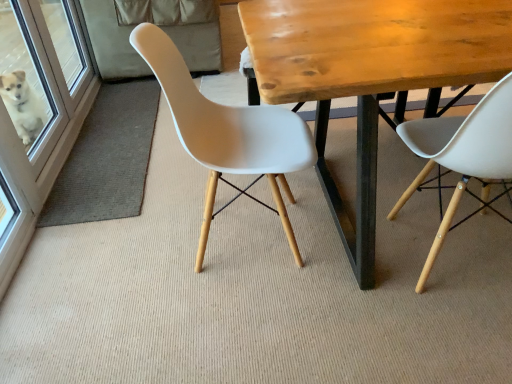
This screenshot has height=384, width=512. What do you see at coordinates (370, 74) in the screenshot?
I see `wooden table at center` at bounding box center [370, 74].

Describe the element at coordinates (227, 133) in the screenshot. The image size is (512, 384). I see `white plastic chair at center, the 1th chair positioned from the left` at that location.

Where is `white glossy screen door at left`? white glossy screen door at left is located at coordinates (40, 109).

Find the location of a particular element. This screenshot has height=384, width=512. wooden table at center is located at coordinates (370, 74).

Is there a large distance between white glossy screen door at left and white plastic chair at right, the second chair in the left-to-right sequence?

Indeed, white glossy screen door at left is not near white plastic chair at right, the second chair in the left-to-right sequence.

Does white glossy screen door at left have a greater height compared to white plastic chair at right, which is the 1th chair in right-to-left order?

No, white glossy screen door at left is not taller than white plastic chair at right, which is the 1th chair in right-to-left order.

I want to click on screen door on the left of white plastic chair at right, the second chair in the left-to-right sequence, so click(40, 109).

From a real-world perspective, between white glossy screen door at left and white plastic chair at right, which is the 1th chair in right-to-left order, who is vertically lower?

white plastic chair at right, which is the 1th chair in right-to-left order, is physically lower.

From the image's perspective, which is below, white glossy screen door at left or wooden table at center?

wooden table at center, from the image's perspective.

Could you tell me if white glossy screen door at left is turned towards wooden table at center?

Yes, white glossy screen door at left is oriented towards wooden table at center.

From a real-world perspective, is white glossy screen door at left beneath wooden table at center?

No, from a real-world perspective, white glossy screen door at left is not beneath wooden table at center.

From a real-world perspective, who is located higher, wooden table at center or white plastic chair at center, the 1th chair positioned from the left?

In real-world perspective, white plastic chair at center, the 1th chair positioned from the left, is above.

This screenshot has height=384, width=512. In order to click on table on the right of white plastic chair at center, the second chair viewed from the right in this screenshot , I will do `click(370, 74)`.

Relative to white plastic chair at center, the second chair viewed from the right, is wooden table at center in front or behind?

In the image, wooden table at center appears in front of white plastic chair at center, the second chair viewed from the right.

Can you confirm if wooden table at center is bigger than white plastic chair at center, the 1th chair positioned from the left?

Yes, wooden table at center is bigger than white plastic chair at center, the 1th chair positioned from the left.

Visually, is white plastic chair at right, which is the 1th chair in right-to-left order, positioned to the left or to the right of white glossy screen door at left?

white plastic chair at right, which is the 1th chair in right-to-left order, is to the right of white glossy screen door at left.

Which of these two, white plastic chair at right, which is the 1th chair in right-to-left order, or white glossy screen door at left, stands taller?

Standing taller between the two is white plastic chair at right, which is the 1th chair in right-to-left order.

At what (x,y) coordinates should I click in order to perform the action: click on screen door to the left of white plastic chair at right, the second chair in the left-to-right sequence. Please return your answer as a coordinate pair (x, y). The width and height of the screenshot is (512, 384). Looking at the image, I should click on (40, 109).

From the image's perspective, between white plastic chair at right, the second chair in the left-to-right sequence, and white glossy screen door at left, which one is located above?

white glossy screen door at left is shown above in the image.

Considering the sizes of objects white plastic chair at right, which is the 1th chair in right-to-left order, and wooden table at center in the image provided, who is wider, white plastic chair at right, which is the 1th chair in right-to-left order, or wooden table at center?

Wider between the two is wooden table at center.

Which is more to the right, white plastic chair at right, which is the 1th chair in right-to-left order, or wooden table at center?

white plastic chair at right, which is the 1th chair in right-to-left order, is more to the right.

From the image's perspective, which is above, white plastic chair at right, the second chair in the left-to-right sequence, or wooden table at center?

wooden table at center.

Is white plastic chair at right, the second chair in the left-to-right sequence, bigger or smaller than wooden table at center?

white plastic chair at right, the second chair in the left-to-right sequence, is smaller than wooden table at center.

From the image's perspective, is white plastic chair at right, which is the 1th chair in right-to-left order, beneath white plastic chair at center, the 1th chair positioned from the left?

Correct, white plastic chair at right, which is the 1th chair in right-to-left order, appears lower than white plastic chair at center, the 1th chair positioned from the left, in the image.

Is white plastic chair at right, which is the 1th chair in right-to-left order, further to camera compared to white plastic chair at center, the second chair viewed from the right?

No.

Can you confirm if white plastic chair at right, which is the 1th chair in right-to-left order, is shorter than white plastic chair at center, the second chair viewed from the right?

Incorrect, the height of white plastic chair at right, which is the 1th chair in right-to-left order, does not fall short of that of white plastic chair at center, the second chair viewed from the right.

From a real-world perspective, is wooden table at center positioned under white glossy screen door at left based on gravity?

Yes, from a real-world perspective, wooden table at center is under white glossy screen door at left.

Considering the relative positions of wooden table at center and white glossy screen door at left in the image provided, is wooden table at center to the left or to the right of white glossy screen door at left?

Clearly, wooden table at center is on the right of white glossy screen door at left in the image.

Is wooden table at center beside white glossy screen door at left?

There is a gap between wooden table at center and white glossy screen door at left.

Is wooden table at center taller than white glossy screen door at left?

Yes, wooden table at center is taller than white glossy screen door at left.

This screenshot has width=512, height=384. I want to click on screen door above the white plastic chair at right, which is the 1th chair in right-to-left order (from a real-world perspective), so click(x=40, y=109).

This screenshot has height=384, width=512. Find the location of `table lying in front of the white glossy screen door at left`. table lying in front of the white glossy screen door at left is located at coordinates (370, 74).

Based on the photo, which object lies further to the anchor point white plastic chair at center, the 1th chair positioned from the left, wooden table at center or white glossy screen door at left?

Based on the image, white glossy screen door at left appears to be further to white plastic chair at center, the 1th chair positioned from the left.

Estimate the real-world distances between objects in this image. Which object is further from white plastic chair at center, the 1th chair positioned from the left, white plastic chair at right, the second chair in the left-to-right sequence, or white glossy screen door at left?

Among the two, white glossy screen door at left is located further to white plastic chair at center, the 1th chair positioned from the left.

When comparing their distances from wooden table at center, does white glossy screen door at left or white plastic chair at right, which is the 1th chair in right-to-left order, seem closer?

white plastic chair at right, which is the 1th chair in right-to-left order, lies closer to wooden table at center than the other object.

Looking at the image, which one is located further to white glossy screen door at left, white plastic chair at right, which is the 1th chair in right-to-left order, or wooden table at center?

white plastic chair at right, which is the 1th chair in right-to-left order, is further to white glossy screen door at left.

When comparing their distances from white glossy screen door at left, does wooden table at center or white plastic chair at center, the 1th chair positioned from the left, seem further?

Based on the image, wooden table at center appears to be further to white glossy screen door at left.

Looking at the image, which one is located closer to wooden table at center, white plastic chair at right, the second chair in the left-to-right sequence, or white glossy screen door at left?

Among the two, white plastic chair at right, the second chair in the left-to-right sequence, is located nearer to wooden table at center.

Looking at the image, which one is located further to wooden table at center, white glossy screen door at left or white plastic chair at center, the second chair viewed from the right?

white glossy screen door at left is positioned further to the anchor wooden table at center.

Based on the photo, looking at the image, which one is located further to white plastic chair at center, the 1th chair positioned from the left, white glossy screen door at left or white plastic chair at right, the second chair in the left-to-right sequence?

The object further to white plastic chair at center, the 1th chair positioned from the left, is white glossy screen door at left.

The width and height of the screenshot is (512, 384). What are the coordinates of `table between white plastic chair at center, the 1th chair positioned from the left, and white plastic chair at right, the second chair in the left-to-right sequence, from left to right` in the screenshot? It's located at (370, 74).

Where is `chair between white glossy screen door at left and white plastic chair at right, the second chair in the left-to-right sequence, from left to right`? chair between white glossy screen door at left and white plastic chair at right, the second chair in the left-to-right sequence, from left to right is located at coordinates (227, 133).

Where is `table between white glossy screen door at left and white plastic chair at right, which is the 1th chair in right-to-left order`? This screenshot has width=512, height=384. table between white glossy screen door at left and white plastic chair at right, which is the 1th chair in right-to-left order is located at coordinates (370, 74).

This screenshot has width=512, height=384. I want to click on chair between white glossy screen door at left and wooden table at center from left to right, so click(x=227, y=133).